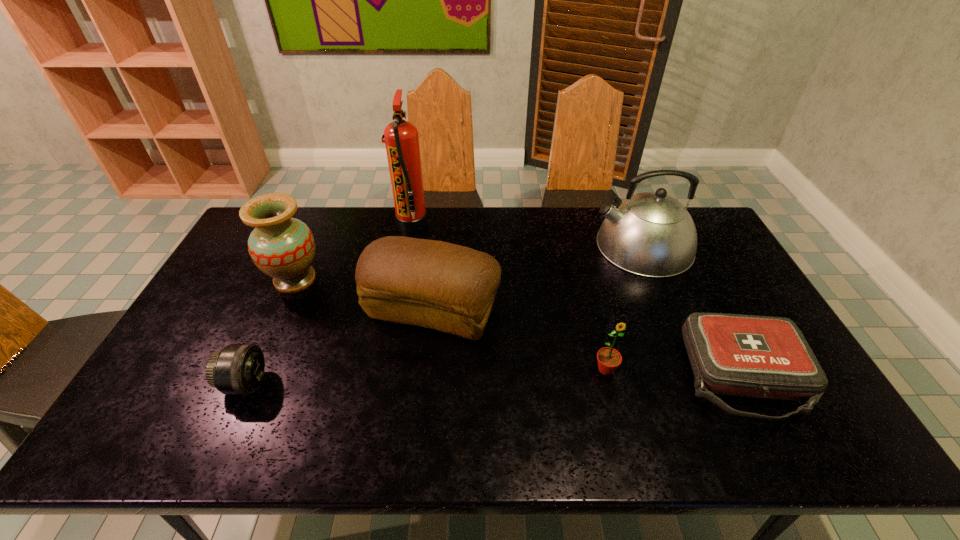
The image size is (960, 540). Identify the location of blank space located from the spout of the kettle. (555, 246).

Image resolution: width=960 pixels, height=540 pixels. In order to click on vacant space located from the spout of the kettle in this screenshot , I will do `click(558, 246)`.

Identify the location of blank space located 0.060m on the right of the vase. The height and width of the screenshot is (540, 960). (343, 280).

You are a GUI agent. You are given a task and a screenshot of the screen. Output one action in this format:
    pyautogui.click(x=<x>, y=<y>)
    Task: Click on the vacant region located 0.280m on the left of the bread
    This screenshot has height=540, width=960.
    Given the screenshot: What is the action you would take?
    (270, 310)

At what (x,y) coordinates should I click in order to perform the action: click on blank area located on the face of the sunflower. Please return your answer as a coordinate pair (x, y). Image resolution: width=960 pixels, height=540 pixels. Looking at the image, I should click on (625, 448).

Identify the location of free location located 0.360m on the front-facing side of the telephoto lens. The height and width of the screenshot is (540, 960). (408, 383).

Find the location of a particular element. This screenshot has height=540, width=960. free location located 0.060m on the back of the first-aid kit is located at coordinates (711, 315).

Locate an element on the screen. fire extinguisher located at the far edge is located at coordinates (401, 140).

I want to click on kettle at the far edge, so click(x=652, y=234).

Image resolution: width=960 pixels, height=540 pixels. I want to click on object that is at the near edge, so click(x=751, y=356).